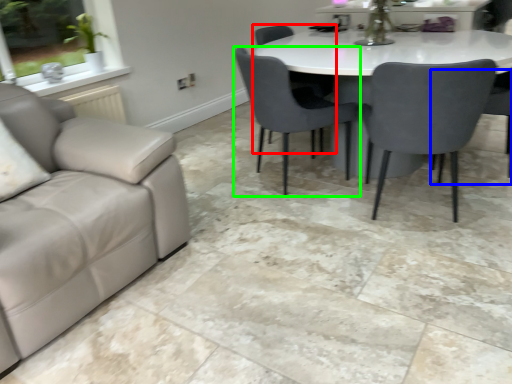
Question: Considering the real-world distances, which object is farthest from chair (highlighted by a red box)? chair (highlighted by a blue box) or chair (highlighted by a green box)?

Choices:
 (A) chair
 (B) chair

Answer: (A)